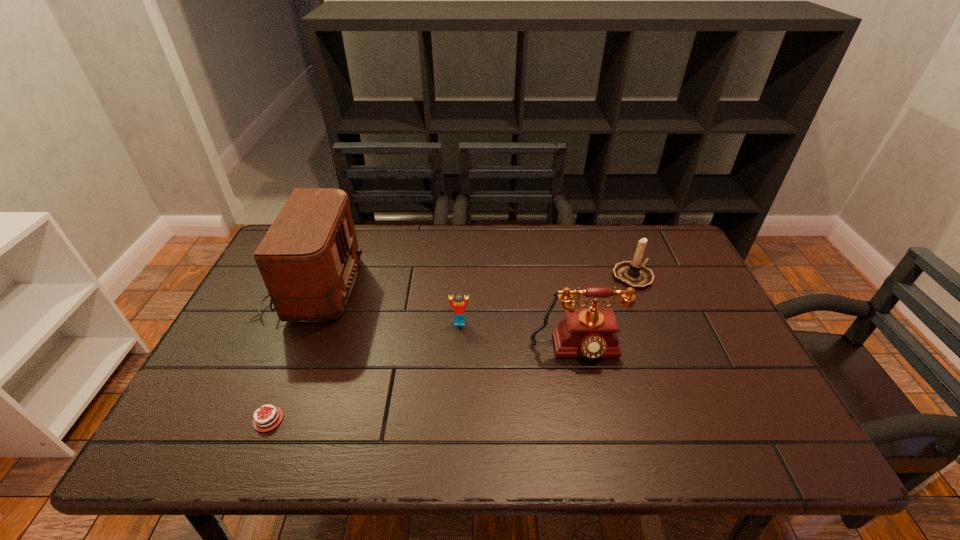
You are a GUI agent. You are given a task and a screenshot of the screen. Output one action in this format:
    pyautogui.click(x=<x>, y=<y>)
    Task: Click on the vacant space that is in between the candle holder and the tallest object
    This screenshot has height=540, width=960.
    Given the screenshot: What is the action you would take?
    pyautogui.click(x=472, y=282)

You are a GUI agent. You are given a task and a screenshot of the screen. Output one action in this format:
    pyautogui.click(x=<x>, y=<y>)
    Task: Click on the vacant area between the Lego and the shortest object
    The height and width of the screenshot is (540, 960).
    Given the screenshot: What is the action you would take?
    pyautogui.click(x=364, y=371)

In order to click on vacant region between the chocolate cake and the third object from left to right in this screenshot , I will do `click(364, 371)`.

Locate an element on the screen. The height and width of the screenshot is (540, 960). free space between the rightmost object and the tallest object is located at coordinates (472, 282).

Find the location of `blank region between the Lego and the tallest object`. blank region between the Lego and the tallest object is located at coordinates (386, 305).

What are the coordinates of `free space between the third object from right to left and the third tallest object` in the screenshot? It's located at (546, 300).

Image resolution: width=960 pixels, height=540 pixels. What are the coordinates of `object identified as the third closest to the candle holder` in the screenshot? It's located at (308, 259).

Locate an element on the screen. The height and width of the screenshot is (540, 960). object that is the second nearest to the radio receiver is located at coordinates (459, 306).

Locate an element on the screen. This screenshot has width=960, height=540. free point that satisfies the following two spatial constraints: 1. on the front side of the candle holder; 2. on the front panel of the radio receiver is located at coordinates (637, 287).

Where is `vacant space that satisfies the following two spatial constraints: 1. on the front panel of the chocolate cake; 2. on the left side of the tallest object`? The height and width of the screenshot is (540, 960). vacant space that satisfies the following two spatial constraints: 1. on the front panel of the chocolate cake; 2. on the left side of the tallest object is located at coordinates (256, 419).